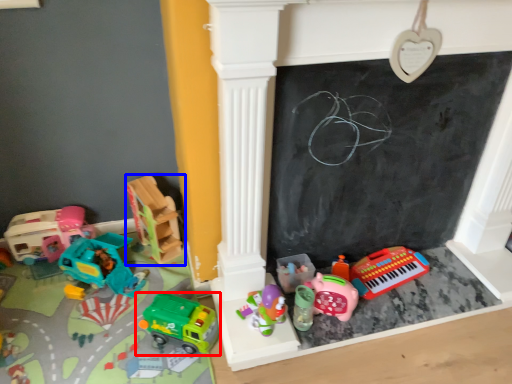
Question: Which of the following is the farthest to the observer, toy (highlighted by a red box) or toy (highlighted by a blue box)?

Choices:
 (A) toy
 (B) toy

Answer: (B)